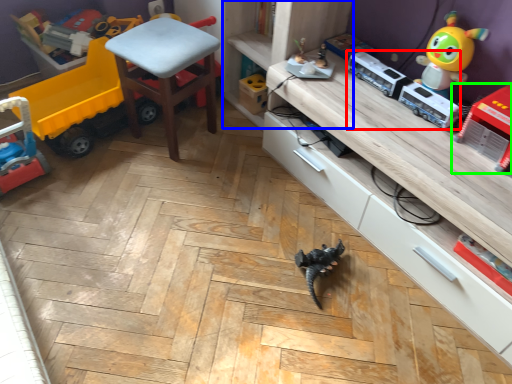
Question: Which object is the closest to the equipment (highlighted by a red box)? Choose among these: shelf (highlighted by a blue box) or toy (highlighted by a green box).

Choices:
 (A) shelf
 (B) toy

Answer: (B)